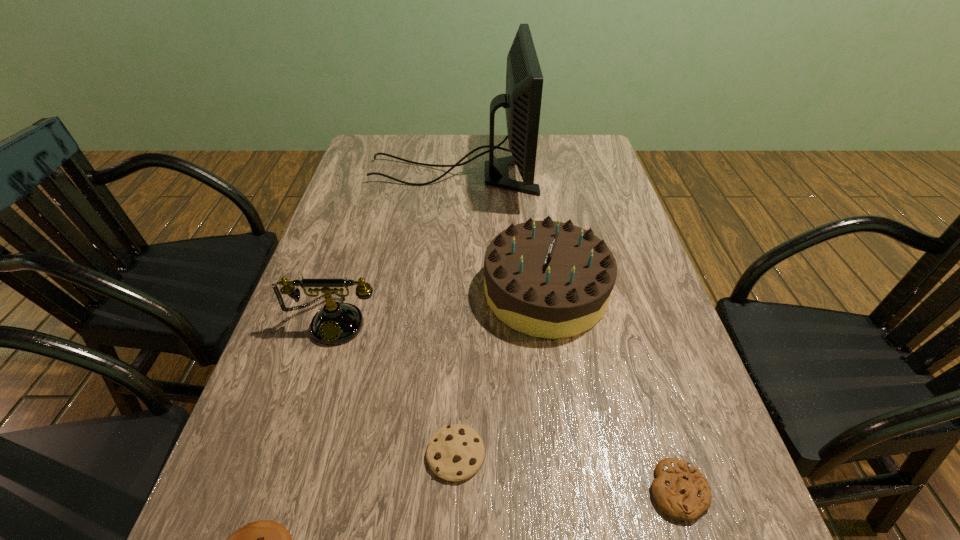
The width and height of the screenshot is (960, 540). I want to click on the tallest object, so click(524, 81).

Locate an element on the screen. computer monitor is located at coordinates (524, 81).

Image resolution: width=960 pixels, height=540 pixels. I want to click on birthday cake, so click(548, 279).

Locate an element on the screen. telephone is located at coordinates 336,323.

What are the coordinates of `the second cookie from right to left` in the screenshot? It's located at (455, 453).

At what (x,y) coordinates should I click in order to perform the action: click on the fourth tallest object. Please return your answer as a coordinate pair (x, y). Looking at the image, I should click on (455, 453).

This screenshot has width=960, height=540. In order to click on the rightmost cookie in this screenshot , I will do `click(681, 491)`.

This screenshot has width=960, height=540. In order to click on the second shortest object in this screenshot , I will do `click(681, 491)`.

I want to click on free space located 0.210m on the screen side of the computer monitor, so [x=602, y=174].

You are a GUI agent. You are given a task and a screenshot of the screen. Output one action in this format:
    pyautogui.click(x=<x>, y=<y>)
    Task: Click on the free space located 0.240m on the front-facing side of the birthday cake
    
    Given the screenshot: What is the action you would take?
    pyautogui.click(x=381, y=292)